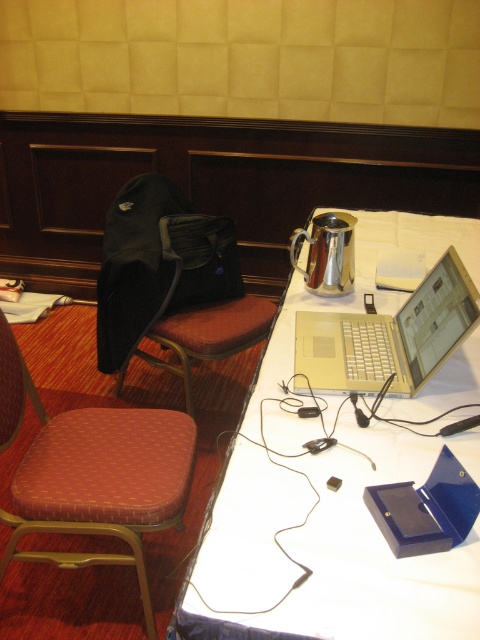
In the scene shown: You are standing at the center of the conference room and looking towards the white table. There are two points marked on the table surface. One is at point (124, 308) and the other is at point (428, 282). Which point is closer to you when you are facing the table?

Point (428, 282) is closer to you because it is in front of point (124, 308) when facing the table.

You are organizing a tech event and need to pack items from the table into a bag. The black fabric bag at left and the silver metallic laptop at upper right are on the table. Which item can hold more items inside it?

The black fabric bag at left is bigger than the silver metallic laptop at upper right, so it can hold more items inside it.